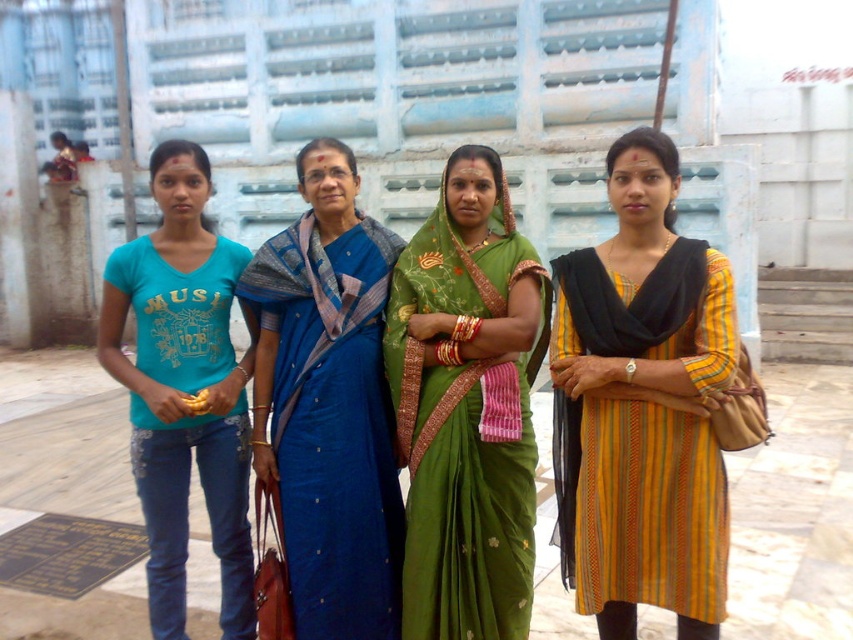
Question: Is the position of yellow striped dress at center more distant than that of blue silk saree at center?

Choices:
 (A) yes
 (B) no

Answer: (B)

Question: From the image, what is the correct spatial relationship of green silk saree at center in relation to blue silk saree at center?

Choices:
 (A) above
 (B) below

Answer: (B)

Question: Which point is farther from the camera taking this photo?

Choices:
 (A) (670, 566)
 (B) (405, 321)
 (C) (257, 385)

Answer: (C)

Question: Which point is farther to the camera?

Choices:
 (A) (341, 276)
 (B) (106, 348)
 (C) (666, 592)
 (D) (506, 627)

Answer: (B)

Question: Which point appears farthest from the camera in this image?

Choices:
 (A) (183, 499)
 (B) (260, 316)
 (C) (654, 360)

Answer: (A)

Question: Does yellow striped dress at center come in front of blue silk saree at center?

Choices:
 (A) yes
 (B) no

Answer: (A)